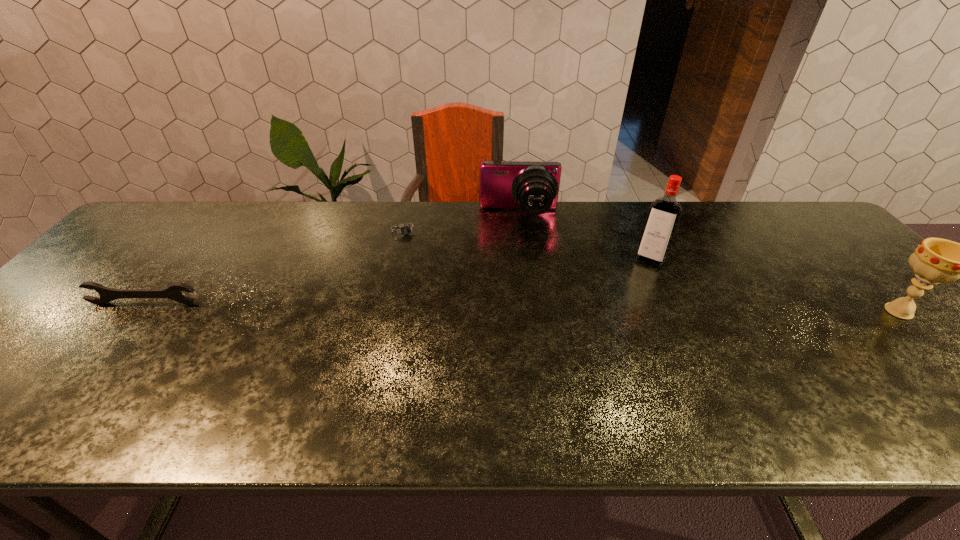
Locate an element on the screen. free point located 0.400m on the front-facing side of the third tallest object is located at coordinates (524, 320).

I want to click on watch positioned at the far edge, so click(405, 230).

The width and height of the screenshot is (960, 540). Find the location of `camera positioned at the far edge`. camera positioned at the far edge is located at coordinates (532, 186).

Where is `object that is at the left edge`? object that is at the left edge is located at coordinates (173, 292).

Find the location of a particular element. object located in the right edge section of the desktop is located at coordinates (935, 260).

This screenshot has height=540, width=960. Identify the location of vacant space at the far edge of the desktop. (721, 204).

The image size is (960, 540). I want to click on free space at the near edge of the desktop, so click(x=255, y=372).

Locate an element on the screen. vacant region at the right edge of the desktop is located at coordinates (852, 298).

Where is `vacant space at the far right corner of the desktop`? This screenshot has height=540, width=960. vacant space at the far right corner of the desktop is located at coordinates (817, 235).

I want to click on blank region between the second shortest object and the watch, so click(276, 267).